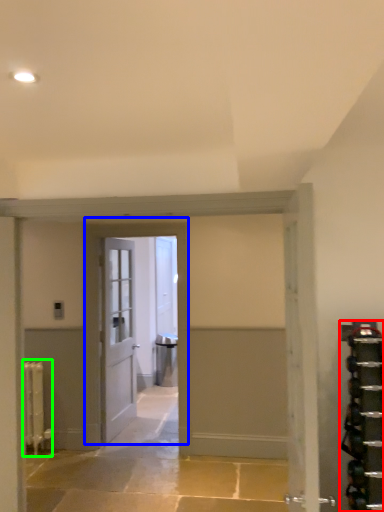
Question: Estimate the real-world distances between objects in this image. Which object is farther from shelf (highlighted by a red box), door (highlighted by a blue box) or radiator (highlighted by a green box)?

Choices:
 (A) door
 (B) radiator

Answer: (B)